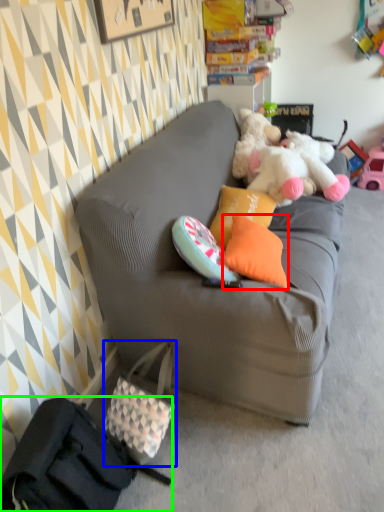
Question: Estimate the real-world distances between objects in this image. Which object is closer to pillow (highlighted by a red box), handbag (highlighted by a blue box) or handbag (highlighted by a green box)?

Choices:
 (A) handbag
 (B) handbag

Answer: (A)